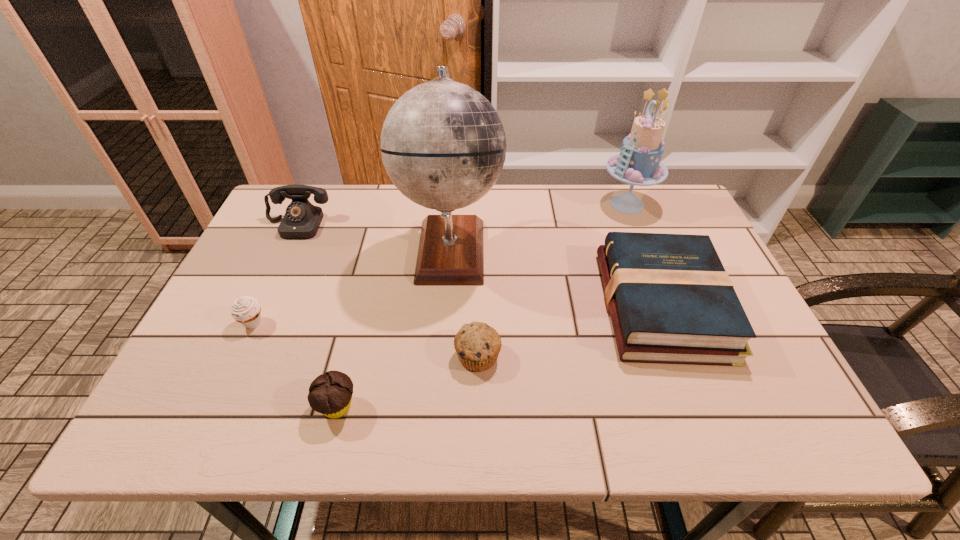
Identify the location of free space located 0.330m with a ladder on the side of the second tallest object. (494, 204).

You are a GUI agent. You are given a task and a screenshot of the screen. Output one action in this format:
    pyautogui.click(x=<x>, y=<y>)
    Task: Click on the vacant space located with a ladder on the side of the second tallest object
    This screenshot has height=540, width=960.
    Given the screenshot: What is the action you would take?
    pyautogui.click(x=541, y=204)

At what (x,y) coordinates should I click in order to perform the action: click on vacant space situated on the dial of the fifth shortest object. Please return your answer as a coordinate pair (x, y). This screenshot has height=540, width=960. Looking at the image, I should click on pos(244,341).

Find the location of a particular element. blank space located on the back of the hardback book is located at coordinates (629, 218).

I want to click on free space located on the back of the leftmost muffin, so click(x=265, y=298).

Locate an element on the screen. The height and width of the screenshot is (540, 960). free space located 0.080m on the back of the second nearest muffin is located at coordinates (478, 311).

I want to click on blank space located on the right of the nearest muffin, so click(487, 407).

Locate an element on the screen. This screenshot has height=540, width=960. globe present at the far edge is located at coordinates (443, 145).

Find the location of a particular element. cake that is positioned at the far edge is located at coordinates (639, 163).

Image resolution: width=960 pixels, height=540 pixels. I want to click on telephone located at the far edge, so click(x=302, y=219).